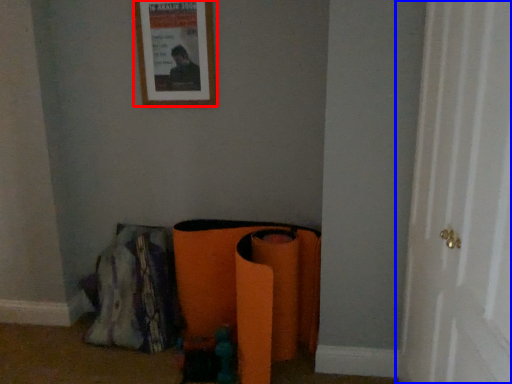
Question: Which point is further to the camera, picture frame (highlighted by a red box) or door (highlighted by a blue box)?

Choices:
 (A) picture frame
 (B) door

Answer: (A)